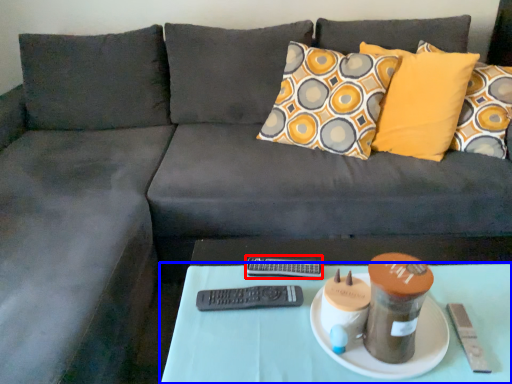
Question: Which object is closer to the camera taking this photo, remote (highlighted by a red box) or table (highlighted by a blue box)?

Choices:
 (A) remote
 (B) table

Answer: (B)